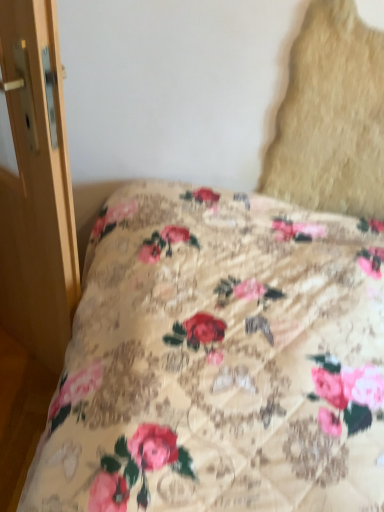
Question: Considering the positions of wooden door at left and beige textured pillow at upper right in the image, is wooden door at left taller or shorter than beige textured pillow at upper right?

Choices:
 (A) tall
 (B) short

Answer: (A)

Question: Does point (26, 187) appear closer or farther from the camera than point (324, 209)?

Choices:
 (A) farther
 (B) closer

Answer: (B)

Question: Is wooden door at left inside the boundaries of beige textured pillow at upper right, or outside?

Choices:
 (A) inside
 (B) outside

Answer: (B)

Question: Based on their positions, is beige textured pillow at upper right located to the left or right of wooden door at left?

Choices:
 (A) right
 (B) left

Answer: (A)

Question: Is point (360, 185) closer or farther from the camera than point (43, 217)?

Choices:
 (A) closer
 (B) farther

Answer: (B)

Question: From the image's perspective, relative to wooden door at left, is beige textured pillow at upper right above or below?

Choices:
 (A) above
 (B) below

Answer: (A)

Question: In terms of size, does beige textured pillow at upper right appear bigger or smaller than wooden door at left?

Choices:
 (A) small
 (B) big

Answer: (A)